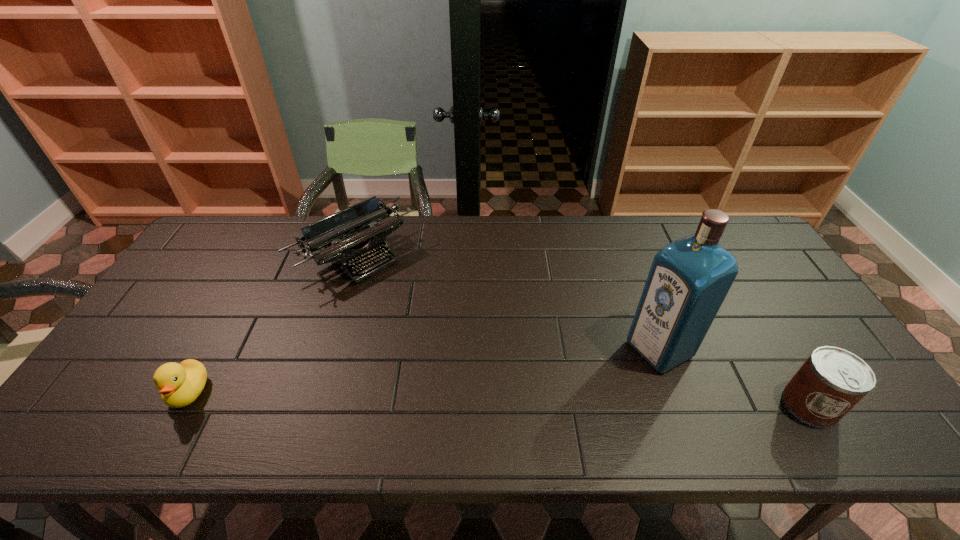
What are the coordinates of `vacant space located 0.220m on the flat label side of the second object from right to left` in the screenshot? It's located at (565, 399).

At what (x,y) coordinates should I click in order to perform the action: click on vacant region located 0.340m on the typing side of the third object from right to left. Please return your answer as a coordinate pair (x, y). The width and height of the screenshot is (960, 540). Looking at the image, I should click on (461, 351).

Where is `vacant space located 0.150m on the typing side of the third object from right to left`? vacant space located 0.150m on the typing side of the third object from right to left is located at coordinates (418, 310).

Where is `free space located 0.350m on the typing side of the third object from right to left`? The width and height of the screenshot is (960, 540). free space located 0.350m on the typing side of the third object from right to left is located at coordinates (464, 354).

Locate an element on the screen. This screenshot has width=960, height=540. object present at the far edge is located at coordinates (358, 226).

Locate an element on the screen. This screenshot has width=960, height=540. duckling located in the near edge section of the desktop is located at coordinates (180, 384).

Find the location of a particular element. This screenshot has width=960, height=540. can that is positioned at the near edge is located at coordinates (832, 380).

What are the coordinates of `liquor present at the near edge` in the screenshot? It's located at point(689,278).

The image size is (960, 540). What are the coordinates of `object positioned at the right edge` in the screenshot? It's located at (832, 380).

You are a GUI agent. You are given a task and a screenshot of the screen. Output one action in this format:
    pyautogui.click(x=<x>, y=<y>)
    Task: Click on the object present at the near right corner
    
    Given the screenshot: What is the action you would take?
    pyautogui.click(x=832, y=380)